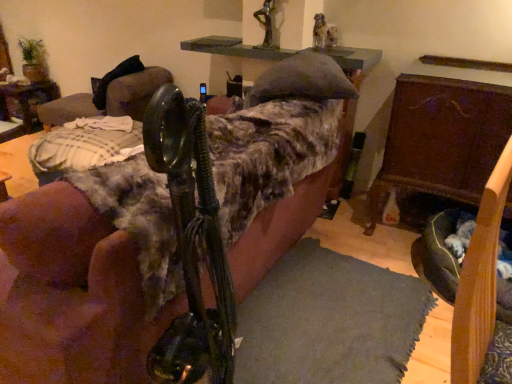
Question: In which direction should I rotate to look at velvet couch at center, placed as the second furniture when sorted from right to left?

Choices:
 (A) right
 (B) left

Answer: (B)

Question: From a real-world perspective, is black leather swivel chair at upper left physically above wooden table at left?

Choices:
 (A) no
 (B) yes

Answer: (B)

Question: Considering the relative positions of black leather swivel chair at upper left and wooden table at left in the image provided, is black leather swivel chair at upper left to the left of wooden table at left from the viewer's perspective?

Choices:
 (A) yes
 (B) no

Answer: (B)

Question: Is black leather swivel chair at upper left directly adjacent to wooden table at left?

Choices:
 (A) no
 (B) yes

Answer: (A)

Question: Is black leather swivel chair at upper left wider than wooden table at left?

Choices:
 (A) yes
 (B) no

Answer: (A)

Question: Can you confirm if black leather swivel chair at upper left is smaller than wooden table at left?

Choices:
 (A) yes
 (B) no

Answer: (B)

Question: Considering the relative positions of black leather swivel chair at upper left and wooden table at left in the image provided, is black leather swivel chair at upper left in front of wooden table at left?

Choices:
 (A) no
 (B) yes

Answer: (B)

Question: From the image's perspective, is wooden chest at right, placed as the first furniture when sorted from right to left, under wooden table at left?

Choices:
 (A) yes
 (B) no

Answer: (A)

Question: Is wooden table at left completely or partially inside wooden chest at right, which is the second furniture in left-to-right order?

Choices:
 (A) yes
 (B) no

Answer: (B)

Question: Can you confirm if wooden chest at right, which is the second furniture in left-to-right order, is taller than wooden table at left?

Choices:
 (A) yes
 (B) no

Answer: (A)

Question: From a real-world perspective, does wooden chest at right, placed as the first furniture when sorted from right to left, sit lower than wooden table at left?

Choices:
 (A) no
 (B) yes

Answer: (A)

Question: Is wooden chest at right, which is the second furniture in left-to-right order, further to the viewer compared to wooden table at left?

Choices:
 (A) yes
 (B) no

Answer: (B)

Question: From a real-world perspective, is wooden chest at right, placed as the first furniture when sorted from right to left, on wooden table at left?

Choices:
 (A) no
 (B) yes

Answer: (B)

Question: From a real-world perspective, does metallic statue at upper center sit lower than wooden chest at right, which is the second furniture in left-to-right order?

Choices:
 (A) no
 (B) yes

Answer: (A)